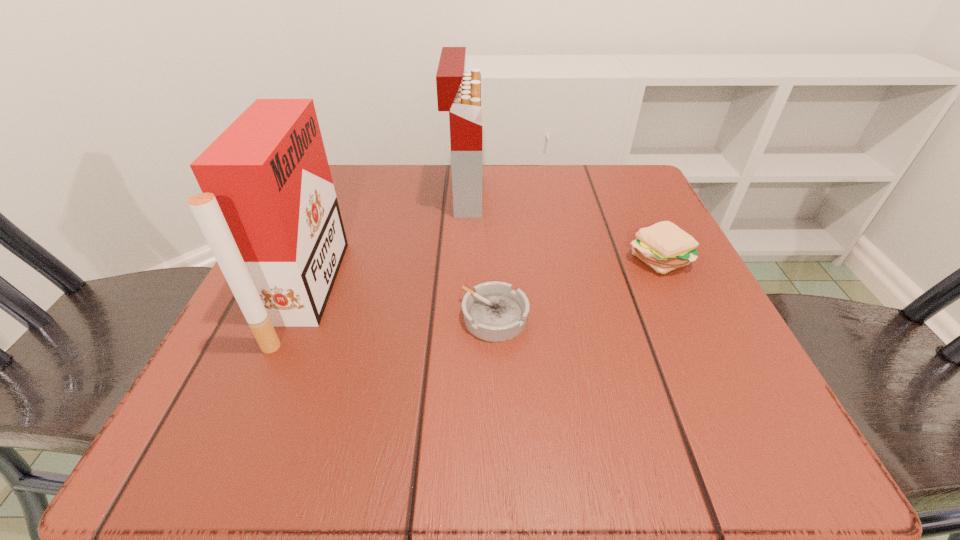
At what (x,y) coordinates should I click in order to perform the action: click on blank region between the farther cigarette case and the nearer cigarette case. Please return your answer as a coordinate pair (x, y). Image resolution: width=960 pixels, height=540 pixels. Looking at the image, I should click on (385, 244).

Where is `free space between the ashtray and the farther cigarette case`? The height and width of the screenshot is (540, 960). free space between the ashtray and the farther cigarette case is located at coordinates (480, 256).

Identify the location of free spot between the shortest object and the farthest object. (480, 256).

This screenshot has height=540, width=960. I want to click on vacant area between the farthest object and the rightmost object, so click(561, 226).

The width and height of the screenshot is (960, 540). In order to click on vacant point located between the farther cigarette case and the third tallest object in this screenshot , I will do `click(561, 226)`.

Locate an element on the screen. The height and width of the screenshot is (540, 960). vacant point located between the patty and the ashtray is located at coordinates (576, 287).

This screenshot has height=540, width=960. Identify the location of free point between the shortest object and the nearer cigarette case. (400, 305).

Image resolution: width=960 pixels, height=540 pixels. I want to click on vacant space that's between the left cigarette case and the third tallest object, so click(x=482, y=274).

Locate an element on the screen. The image size is (960, 540). empty space between the ashtray and the nearer cigarette case is located at coordinates (400, 305).

The height and width of the screenshot is (540, 960). Find the location of `vacant region between the patty and the farther cigarette case`. vacant region between the patty and the farther cigarette case is located at coordinates (561, 226).